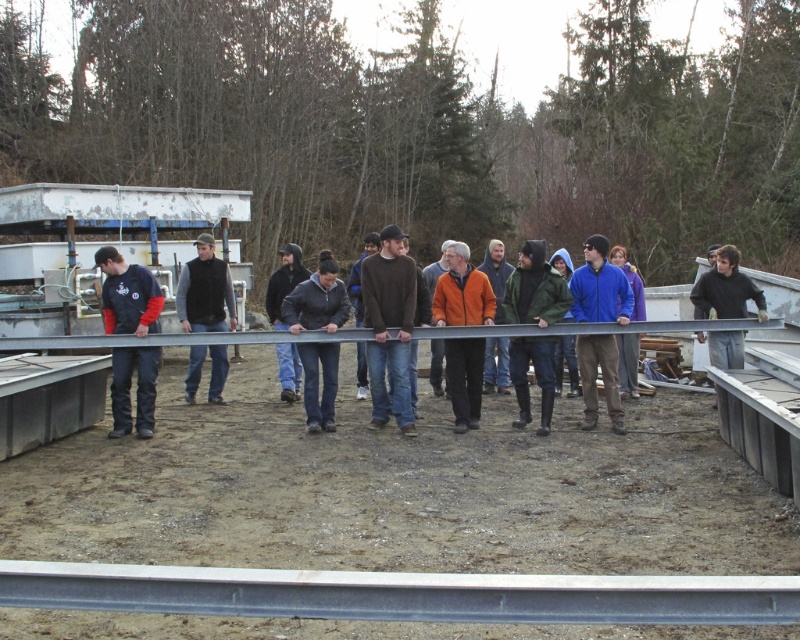
You are a construction worker who needs to choose between the brown sweater at center and the dark green woolen jacket at center for a cold day. Which one would provide more warmth based on their sizes?

The dark green woolen jacket at center is larger in size than the brown sweater at center, so it would provide more warmth as larger garments typically cover more body area and trap more heat.

You are a safety inspector at the construction site. You need to ensure that the workers are maintaining a safe distance from each other to prevent accidents. The minimum safe distance required is 1.5 meters. Are the workers wearing the matte blue shirt at left and dark gray vest at center following the safety guidelines?

The matte blue shirt at left is 1.23 meters from the dark gray vest at center, which is less than the required 1.5 meters. Therefore, they are not following the safety guidelines.

You are a construction worker on the dirt ground. You need to place a tool on the ground between the gray metallic rail at center and the matte blue shirt at left. Where should you place it?

The gray metallic rail at center is below the matte blue shirt at left, so placing the tool on the ground between them would require placing it below the matte blue shirt at left and above the gray metallic rail at center.